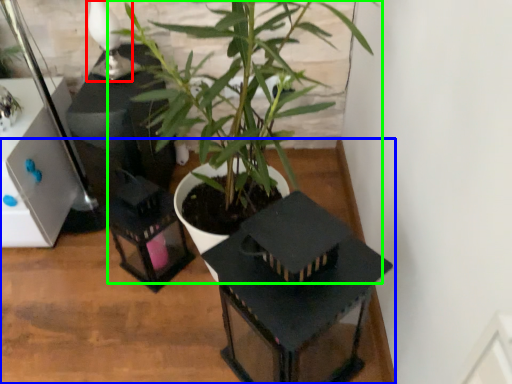
Question: Which is nearer to the table lamp (highlighted by a red box)? table (highlighted by a blue box) or houseplant (highlighted by a green box).

Choices:
 (A) table
 (B) houseplant

Answer: (B)